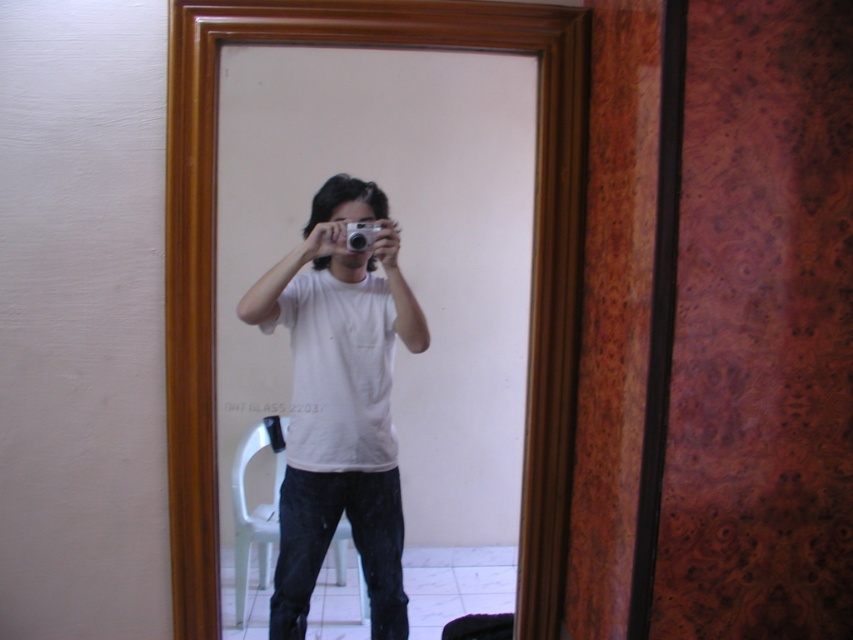
Question: Which object appears closest to the camera in this image?

Choices:
 (A) white matte t-shirt at center
 (B) silver metallic camera at center
 (C) wooden frame at center

Answer: (C)

Question: Which object is positioned farthest from the white matte t-shirt at center?

Choices:
 (A) wooden frame at center
 (B) silver metallic camera at center

Answer: (B)

Question: Does wooden frame at center come behind white matte t-shirt at center?

Choices:
 (A) no
 (B) yes

Answer: (A)

Question: Is wooden frame at center to the left of white matte t-shirt at center from the viewer's perspective?

Choices:
 (A) yes
 (B) no

Answer: (B)

Question: Which of the following is the farthest from the observer?

Choices:
 (A) (376, 221)
 (B) (321, 371)

Answer: (B)

Question: Is wooden frame at center smaller than white matte t-shirt at center?

Choices:
 (A) no
 (B) yes

Answer: (A)